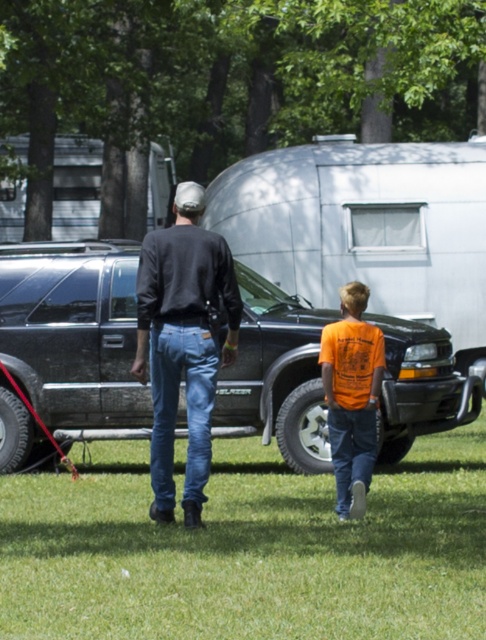
You are standing at the camera position and see the two people walking towards the black glossy truck at center. Based on their direction, do they appear to be moving towards or away from the truck?

The two people are walking away from the camera towards the black glossy truck at center, so they appear to be moving towards the truck.